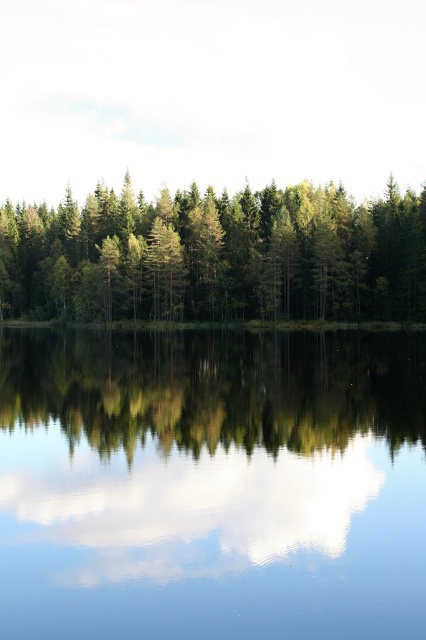
Does transparent glass water at center appear over green matte tree at center?

Actually, transparent glass water at center is below green matte tree at center.

Who is lower down, transparent glass water at center or green matte tree at center?

transparent glass water at center is lower down.

This screenshot has width=426, height=640. Identify the location of transparent glass water at center. (212, 484).

The height and width of the screenshot is (640, 426). Identify the location of transparent glass water at center. (212, 484).